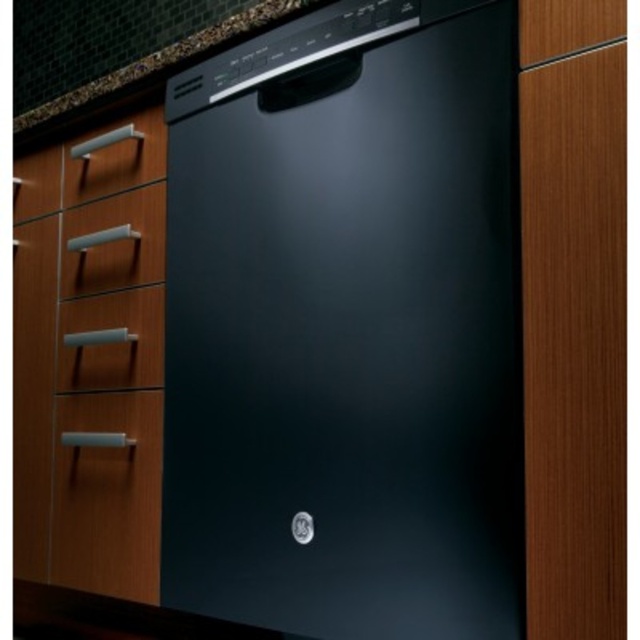
Question: Considering the real-world distances, which object is closest to the satin nickel drawer at upper left?

Choices:
 (A) satin nickel drawer at center
 (B) matte silver drawer at lower left
 (C) black matte dishwasher at center
 (D) satin silver drawer at left

Answer: (A)

Question: Can you confirm if satin nickel drawer at center is positioned to the right of satin silver drawer at left?

Choices:
 (A) yes
 (B) no

Answer: (A)

Question: In this image, where is matte silver drawer at lower left located relative to satin silver drawer at left?

Choices:
 (A) above
 (B) below

Answer: (B)

Question: Which of the following is the farthest from the observer?

Choices:
 (A) black matte dishwasher at center
 (B) matte silver drawer at lower left

Answer: (B)

Question: Which object is closer to the camera taking this photo?

Choices:
 (A) satin nickel drawer at center
 (B) matte silver drawer at lower left

Answer: (B)

Question: Is satin nickel drawer at upper left bigger than satin silver drawer at left?

Choices:
 (A) yes
 (B) no

Answer: (A)